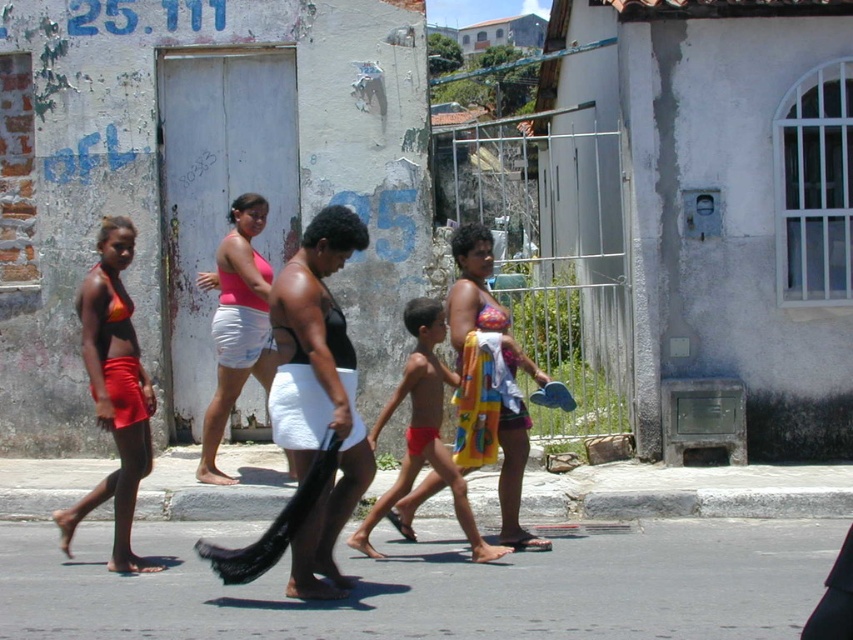
From the picture: You are a photographer trying to capture both the pink fabric top at center and the red fabric towel at center in the same frame. Which object should you focus on first to ensure both are in the frame?

You should focus on the red fabric towel at center first because it is larger than the pink fabric top at center, ensuring both can fit within the frame.

You are a photographer trying to capture the matte orange bikini top at left in your shot. The camera you are using has a field of view that covers up to 0.6 of the image area. Given that the point at coordinates [113,392] is outside your current frame, can you adjust your camera to include the matte orange bikini top at left within the field of view?

The point at coordinates [113,392] is where the matte orange bikini top at left is located. Since the camera can only capture up to 0.6 of the image area, and the point is at 0.613 which exceeds the maximum coverage of 0.6, the camera cannot include the matte orange bikini top at left in the current field of view without adjusting the position or zoom. However, the question states that the point is outside the current frame, so the photographer needs to adjust the camera to bring the point within the 0.6

You are a fashion designer observing the two bikinis in the scene. The black matte bikini top at center and the matte orange bikini top at left. Which one has a smaller width?

The black matte bikini top at center has a smaller width than the matte orange bikini top at left.